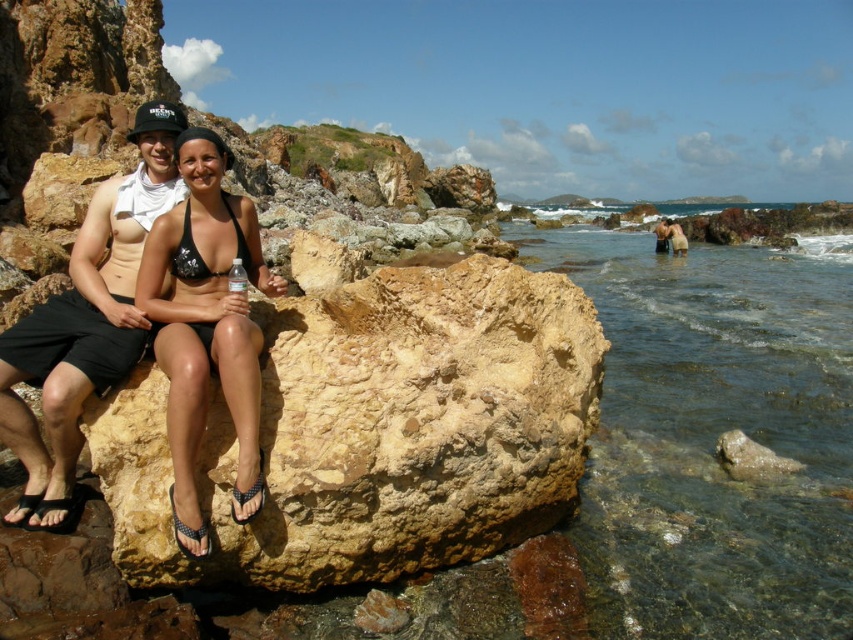
You are a photographer trying to capture the matte black shorts at left. You notice a point at coordinates (86, 323) in your viewfinder. What does this point correspond to?

The point at coordinates (86, 323) corresponds to the matte black shorts at left.

You are a photographer trying to capture both the matte black shorts at left and the matte black bikini at lower right in the same frame. Given their sizes, which object should you focus on to ensure both fit clearly in the photo?

Since the matte black shorts at left is smaller in size compared to the matte black bikini at lower right, you should focus on the matte black shorts at left to ensure both objects fit clearly in the photo.